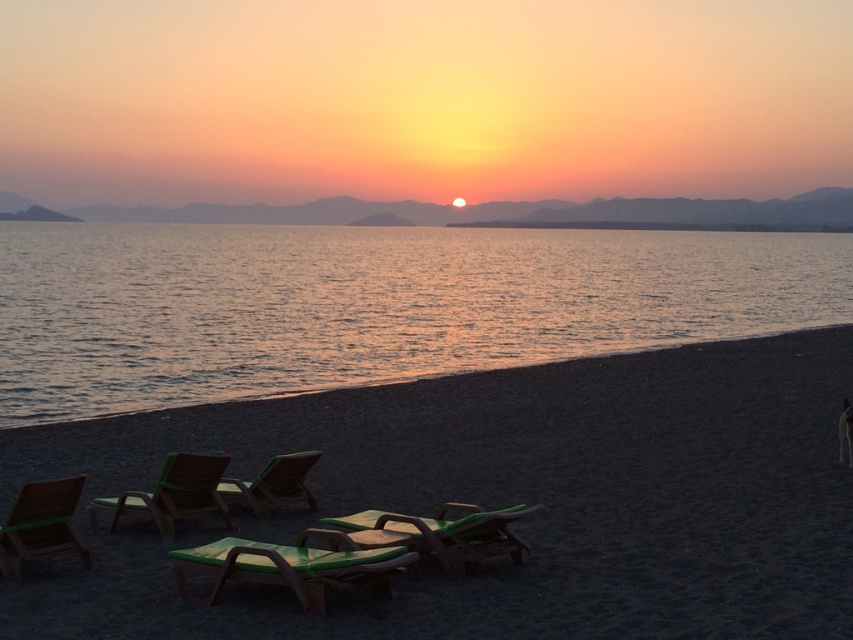
Question: Which of the following is the closest to the observer?

Choices:
 (A) green plastic beach chair at center
 (B) smooth orange sky at center
 (C) glistening silver water at center

Answer: (A)

Question: Is green plastic beach chair at lower center positioned at the back of green fabric beach chair at center?

Choices:
 (A) no
 (B) yes

Answer: (A)

Question: Which point is farther to the camera?

Choices:
 (A) (194, 496)
 (B) (405, 524)
 (C) (776, 557)
 (D) (843, 264)

Answer: (D)

Question: Is glistening silver water at center positioned before green plastic beach chair at lower left?

Choices:
 (A) no
 (B) yes

Answer: (A)

Question: Does glistening silver water at center have a larger size compared to green plastic beach chair at lower left?

Choices:
 (A) yes
 (B) no

Answer: (A)

Question: Among these points, which one is nearest to the camera?

Choices:
 (A) (258, 486)
 (B) (759, 385)

Answer: (A)